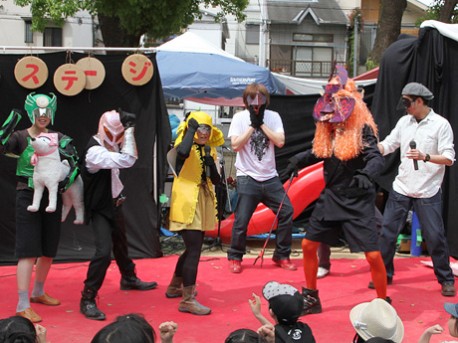
At what (x,y) coordinates should I click in order to perform the action: click on red floor. Please return your answer as a coordinate pair (x, y). The width and height of the screenshot is (458, 343). Looking at the image, I should click on (231, 288).